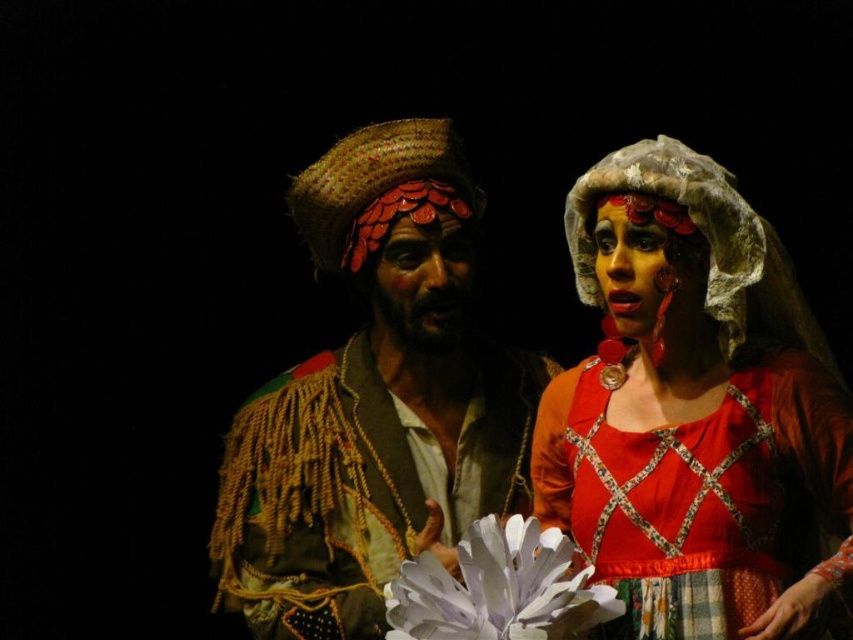
You are designing a stage layout where the matte red dress at center and the textured straw hat at center must be placed side by side. Based on their dimensions, which object should be positioned first to ensure they fit within a 1.2 meter wide stage section?

The matte red dress at center is thinner than the textured straw hat at center, so the textured straw hat at center should be positioned first to ensure it fits within the 1.2 meter wide stage section.

You are standing in the audience watching the performance. The textured straw hat at center is part of the male performer. If you want to hand him a prop that is 1.8 meters long, can you reach him from where you are standing?

The distance between you and the textured straw hat at center is 2.06 meters. Since the prop is 1.8 meters long, you cannot reach him as the distance exceeds the prop length.

Looking at this image, you are an event planner setting up a stage for a cultural performance. You need to ensure that the performers can move freely. Given the description of the textured straw hat at center and the matte red fabric at center, which object might require more vertical clearance due to its height?

The textured straw hat at center has a greater height compared to the matte red fabric at center, so it requires more vertical clearance.